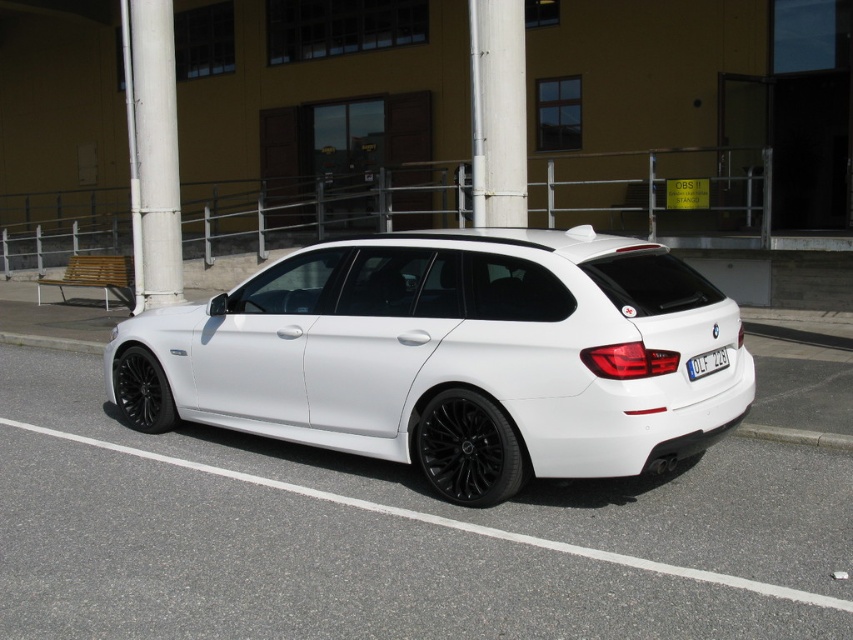
Question: Which object is the farthest from the white matte car at center?

Choices:
 (A) white plastic license plate at center
 (B) black matte wheel at lower left
 (C) black matte wheel at lower center

Answer: (A)

Question: Is black matte wheel at lower center to the left of black matte wheel at lower left from the viewer's perspective?

Choices:
 (A) yes
 (B) no

Answer: (B)

Question: Does white glossy car at center have a larger size compared to black matte wheel at lower left?

Choices:
 (A) yes
 (B) no

Answer: (B)

Question: Is white painted metal pole at upper left in front of white plastic license plate at center?

Choices:
 (A) yes
 (B) no

Answer: (B)

Question: Which is farther from the black matte wheel at lower left?

Choices:
 (A) white glossy car at center
 (B) black matte wheel at lower center
 (C) white plastic license plate at center
 (D) white painted metal pole at upper left

Answer: (D)

Question: Among these points, which one is nearest to the camera?

Choices:
 (A) 447,432
 (B) 161,376
 (C) 476,465

Answer: (C)